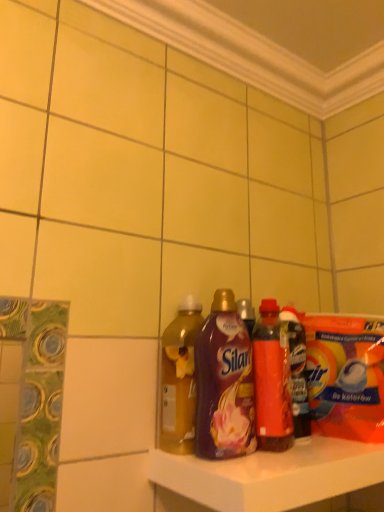
The width and height of the screenshot is (384, 512). What are the coordinates of `free space on the front side of translucent plastic bottle at center, which is counted as the 4th bottle, starting from the left` in the screenshot? It's located at (310, 453).